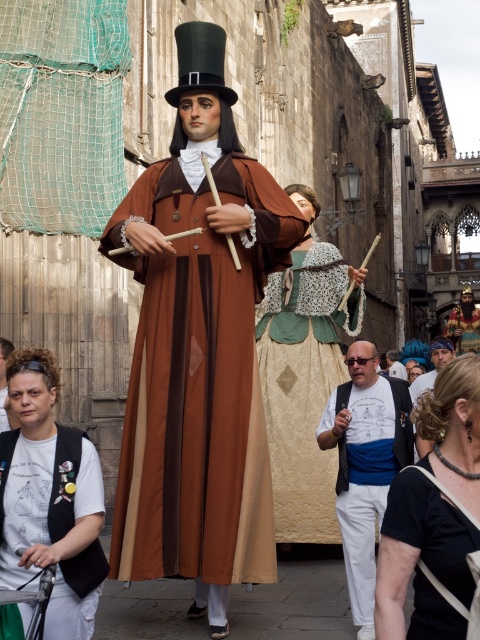
Which is more to the left, beige lace dress at center or black velvet vest at lower left?

From the viewer's perspective, black velvet vest at lower left appears more on the left side.

Is point (259, 365) farther from viewer compared to point (31, 528)?

Yes, point (259, 365) is farther from viewer.

Between point (303, 456) and point (92, 596), which one is positioned behind?

The point (303, 456) is behind.

Identify the location of beige lace dress at center. The height and width of the screenshot is (640, 480). coord(301,392).

Can you confirm if white cotton t-shirt at center is thinner than brown velvet coat at center?

Yes.

Is point (361, 584) positioned in front of point (418, 454)?

Yes, it is in front of point (418, 454).

The width and height of the screenshot is (480, 640). In order to click on white cotton t-shirt at center in this screenshot , I will do `click(364, 465)`.

From the picture: Can you confirm if white cotton t-shirt at center is bigger than black matte robe at center?

Yes.

Does white cotton t-shirt at center have a greater height compared to black matte robe at center?

Yes.

The height and width of the screenshot is (640, 480). In order to click on white cotton t-shirt at center in this screenshot , I will do `click(364, 465)`.

Locate an element on the screen. This screenshot has width=480, height=640. white cotton t-shirt at center is located at coordinates click(364, 465).